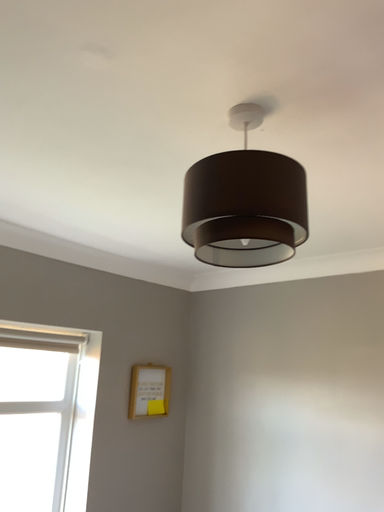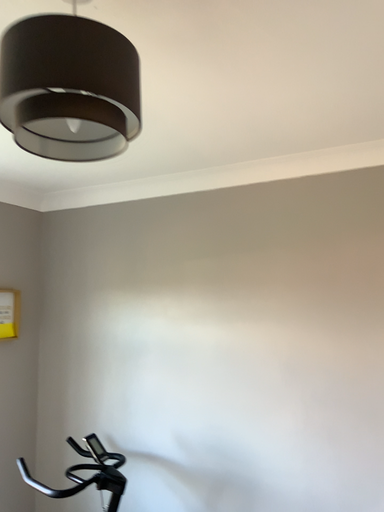
Question: How did the camera likely rotate when shooting the video?

Choices:
 (A) rotated left
 (B) rotated right

Answer: (B)